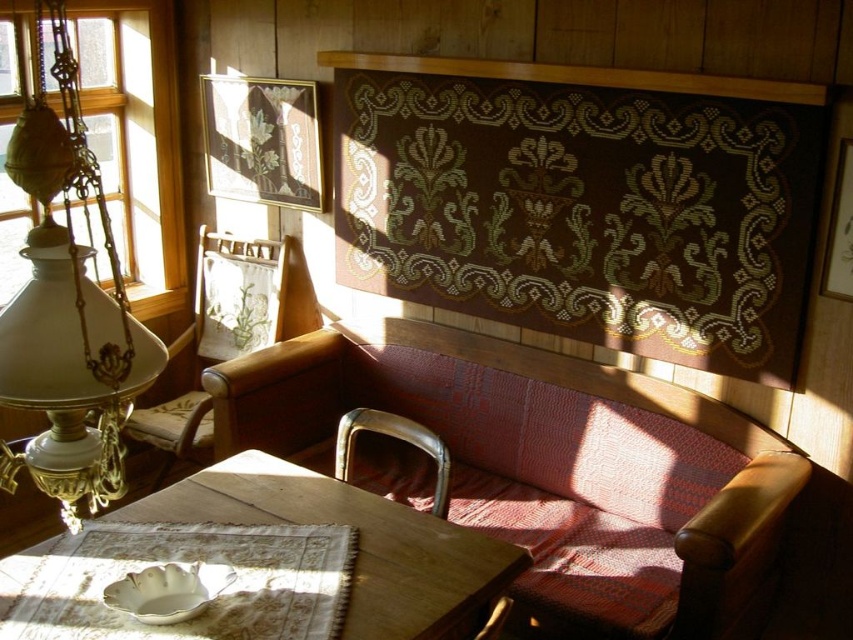
Question: Which point is farther from the camera taking this photo?

Choices:
 (A) (483, 580)
 (B) (360, 417)
 (C) (277, 253)
 (D) (541, 522)

Answer: (C)

Question: Does leather couch at center appear under metallic gold armchair at lower center?

Choices:
 (A) yes
 (B) no

Answer: (A)

Question: Which object appears farthest from the camera in this image?

Choices:
 (A) leather couch at center
 (B) metallic gold armchair at lower center
 (C) wooden upholstered chair at center

Answer: (C)

Question: Which point is farther to the camera?

Choices:
 (A) pyautogui.click(x=444, y=499)
 (B) pyautogui.click(x=219, y=349)
 (C) pyautogui.click(x=560, y=371)

Answer: (B)

Question: Does leather couch at center have a greater width compared to wooden upholstered chair at center?

Choices:
 (A) no
 (B) yes

Answer: (B)

Question: Does leather couch at center appear on the right side of wooden table at center?

Choices:
 (A) yes
 (B) no

Answer: (A)